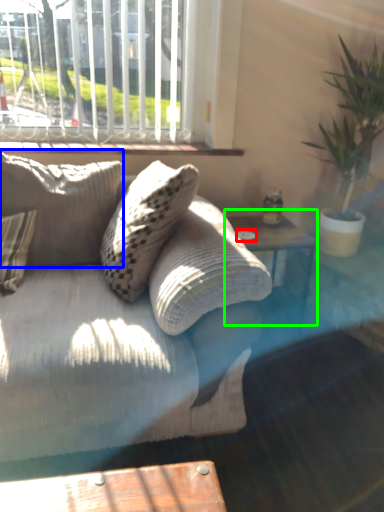
Question: Which object is the farthest from glass plate (highlighted by a red box)? Choose among these: pillow (highlighted by a blue box) or table (highlighted by a green box).

Choices:
 (A) pillow
 (B) table

Answer: (A)